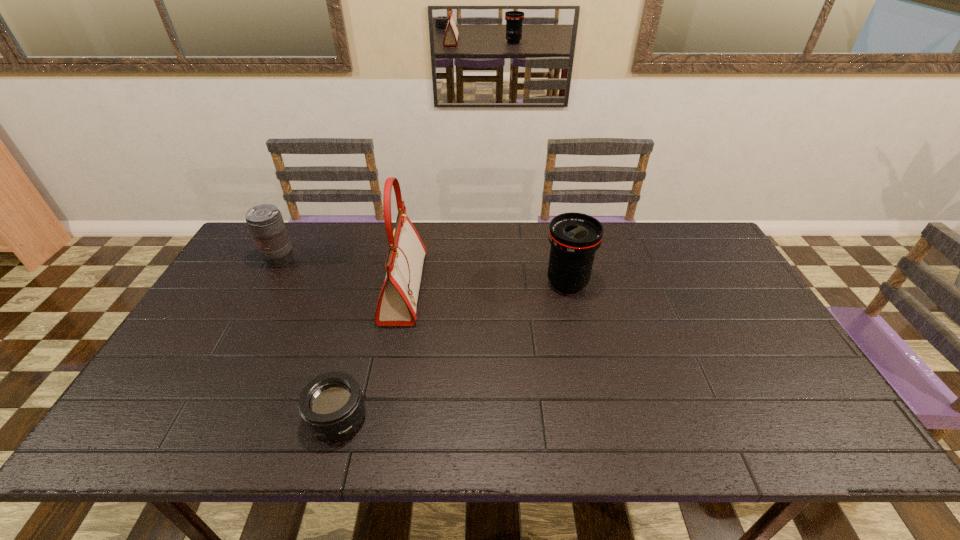
Point out which object is positioned as the second nearest to the rightmost object. Please provide its 2D coordinates. Your answer should be formatted as a tuple, i.e. [(x, y)], where the tuple contains the x and y coordinates of a point satisfying the conditions above.

[(331, 405)]

Locate an element on the screen. The width and height of the screenshot is (960, 540). telephoto lens that is the nearest to the leftmost telephoto lens is located at coordinates (331, 405).

Locate which telephoto lens ranks second in proximity to the leftmost object. Please provide its 2D coordinates. Your answer should be formatted as a tuple, i.e. [(x, y)], where the tuple contains the x and y coordinates of a point satisfying the conditions above.

[(574, 237)]

The image size is (960, 540). Find the location of `vacant region that satisfies the following two spatial constraints: 1. on the side of the leftmost telephoto lens where the control switches are located; 2. on the left side of the rightmost object`. vacant region that satisfies the following two spatial constraints: 1. on the side of the leftmost telephoto lens where the control switches are located; 2. on the left side of the rightmost object is located at coordinates (267, 283).

You are a GUI agent. You are given a task and a screenshot of the screen. Output one action in this format:
    pyautogui.click(x=<x>, y=<y>)
    Task: Click on the free space in the image that satisfies the following two spatial constraints: 1. on the side of the tallest object where the control switches are located; 2. on the right side of the leftmost telephoto lens
    The width and height of the screenshot is (960, 540).
    Given the screenshot: What is the action you would take?
    pyautogui.click(x=264, y=288)

You are a GUI agent. You are given a task and a screenshot of the screen. Output one action in this format:
    pyautogui.click(x=<x>, y=<y>)
    Task: Click on the vacant space that satisfies the following two spatial constraints: 1. on the side of the leftmost object where the control switches are located; 2. on the left side of the rightmost telephoto lens
    This screenshot has width=960, height=540.
    Given the screenshot: What is the action you would take?
    pyautogui.click(x=267, y=283)

The image size is (960, 540). In order to click on blank area in the image that satisfies the following two spatial constraints: 1. on the side of the leftmost telephoto lens where the control switches are located; 2. on the left side of the rightmost object in this screenshot , I will do `click(267, 283)`.

At what (x,y) coordinates should I click in order to perform the action: click on blank space that satisfies the following two spatial constraints: 1. on the side of the rightmost object where the control switches are located; 2. on the right side of the leftmost object. Please return your answer as a coordinate pair (x, y). Looking at the image, I should click on (267, 283).

Find the location of `free space in the image that satisfies the following two spatial constraints: 1. on the side of the tallest object where the control switches are located; 2. on the right side of the leftmost telephoto lens`. free space in the image that satisfies the following two spatial constraints: 1. on the side of the tallest object where the control switches are located; 2. on the right side of the leftmost telephoto lens is located at coordinates (264, 288).